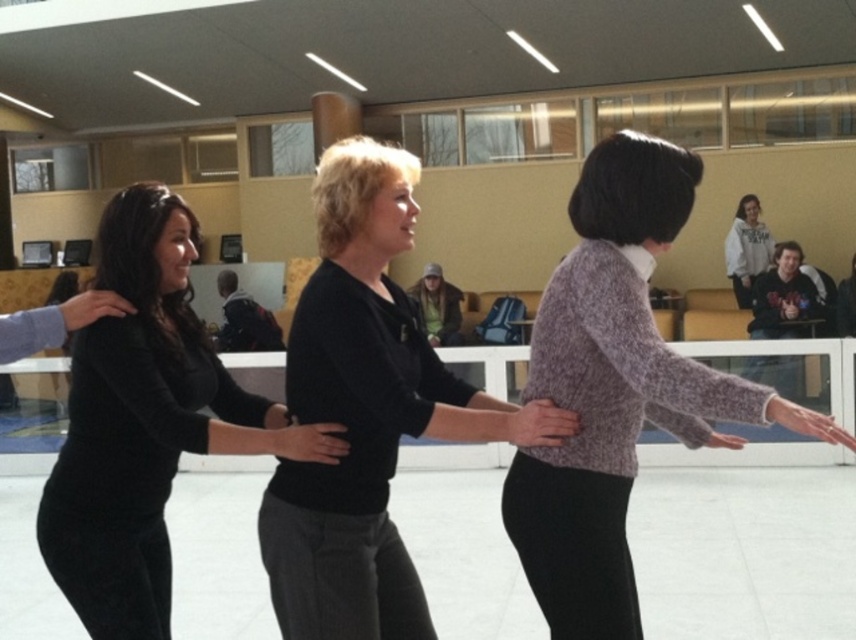
Question: From the image, what is the correct spatial relationship of black ribbed sweater at center in relation to white fleece sweatshirt at upper right?

Choices:
 (A) below
 (B) above

Answer: (A)

Question: Where is black ribbed sweater at center located in relation to white fleece sweatshirt at upper right in the image?

Choices:
 (A) left
 (B) right

Answer: (A)

Question: Which point is closer to the camera?

Choices:
 (A) (734, 289)
 (B) (580, 248)
 (C) (76, 486)
 (D) (290, 385)

Answer: (D)

Question: Which point is closer to the camera?

Choices:
 (A) black matte sweater at center
 (B) black ribbed sweater at center
 (C) white fleece sweatshirt at upper right
 (D) knitted purple sweater at center

Answer: (D)

Question: Estimate the real-world distances between objects in this image. Which object is farther from the black ribbed sweater at center?

Choices:
 (A) white fleece sweatshirt at upper right
 (B) black matte sweater at center

Answer: (A)

Question: Does black ribbed sweater at center appear under white fleece sweatshirt at upper right?

Choices:
 (A) yes
 (B) no

Answer: (A)